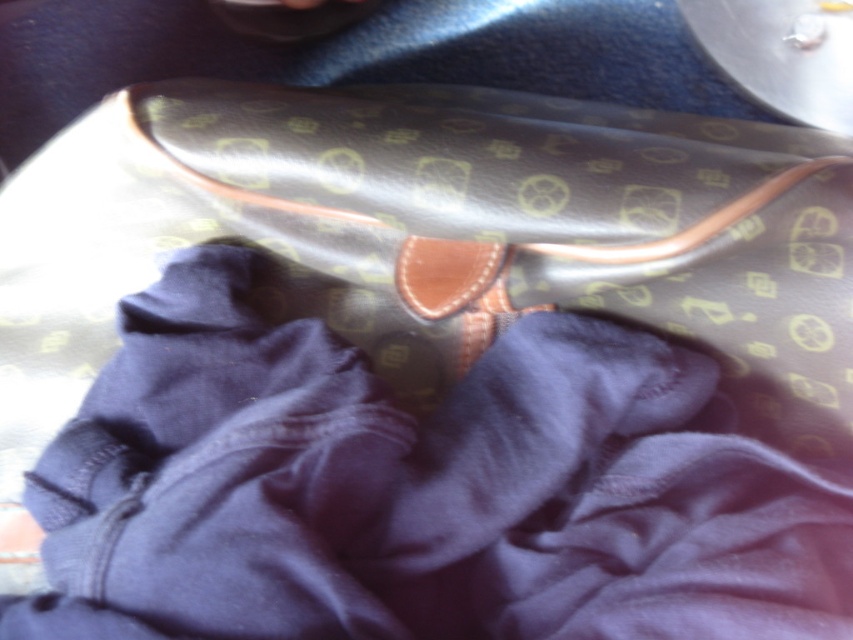
Between navy blue fabric at center and leather bag at center, which one is positioned lower?

navy blue fabric at center is lower down.

What do you see at coordinates (416, 490) in the screenshot? Image resolution: width=853 pixels, height=640 pixels. I see `navy blue fabric at center` at bounding box center [416, 490].

At what (x,y) coordinates should I click in order to perform the action: click on navy blue fabric at center. Please return your answer as a coordinate pair (x, y). The width and height of the screenshot is (853, 640). Looking at the image, I should click on (416, 490).